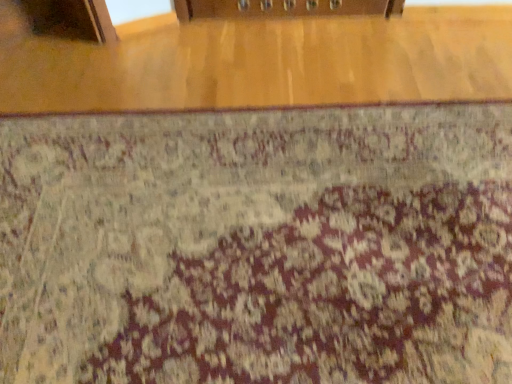
Describe the element at coordinates (258, 247) in the screenshot. This screenshot has width=512, height=384. I see `floral-patterned carpet at center` at that location.

Find the location of a particular element. The image size is (512, 384). floral-patterned carpet at center is located at coordinates (258, 247).

Locate an element on the screen. The image size is (512, 384). floral-patterned carpet at center is located at coordinates (258, 247).